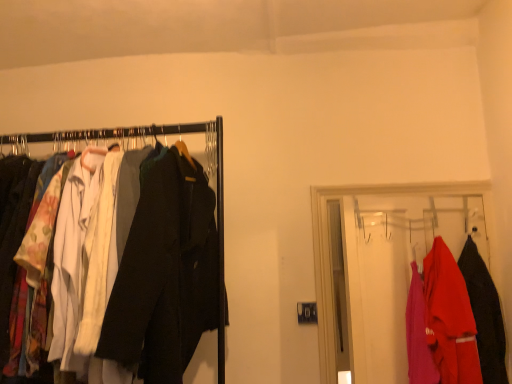
Question: Is matte black coat rack at left, positioned as the 1th closet in left-to-right order, to the left of matte plastic hanger at right, arranged as the second closet when viewed from the left, from the viewer's perspective?

Choices:
 (A) no
 (B) yes

Answer: (B)

Question: Is matte black coat rack at left, positioned as the 1th closet in left-to-right order, outside matte plastic hanger at right, arranged as the second closet when viewed from the left?

Choices:
 (A) yes
 (B) no

Answer: (A)

Question: Considering the relative sizes of matte black coat rack at left, positioned as the 1th closet in left-to-right order, and matte plastic hanger at right, arranged as the second closet when viewed from the left, in the image provided, is matte black coat rack at left, positioned as the 1th closet in left-to-right order, taller than matte plastic hanger at right, arranged as the second closet when viewed from the left,?

Choices:
 (A) no
 (B) yes

Answer: (B)

Question: From a real-world perspective, is matte black coat rack at left, positioned as the 2th closet in right-to-left order, physically above matte plastic hanger at right, arranged as the 1th closet when viewed from the right?

Choices:
 (A) yes
 (B) no

Answer: (A)

Question: Is matte black coat rack at left, positioned as the 1th closet in left-to-right order, further to the viewer compared to matte plastic hanger at right, arranged as the 1th closet when viewed from the right?

Choices:
 (A) yes
 (B) no

Answer: (B)

Question: From the image's perspective, is matte black coat at right, marked as the 2th fancy dress in a left-to-right arrangement, positioned above or below matte red shirt at right, the 1th fancy dress from the left?

Choices:
 (A) below
 (B) above

Answer: (B)

Question: Is matte black coat at right, marked as the 2th fancy dress in a left-to-right arrangement, spatially inside matte red shirt at right, the 1th fancy dress from the left, or outside of it?

Choices:
 (A) inside
 (B) outside

Answer: (B)

Question: In the image, is matte black coat at right, marked as the 2th fancy dress in a left-to-right arrangement, positioned in front of or behind matte red shirt at right, which is the 2th fancy dress in right-to-left order?

Choices:
 (A) front
 (B) behind

Answer: (B)

Question: Does point (481, 344) appear closer or farther from the camera than point (445, 266)?

Choices:
 (A) closer
 (B) farther

Answer: (B)

Question: Based on their positions, is matte black coat rack at left, positioned as the 2th closet in right-to-left order, located to the left or right of matte red shirt at right, which is the 2th fancy dress in right-to-left order?

Choices:
 (A) left
 (B) right

Answer: (A)

Question: From their relative heights in the image, would you say matte black coat rack at left, positioned as the 2th closet in right-to-left order, is taller or shorter than matte red shirt at right, which is the 2th fancy dress in right-to-left order?

Choices:
 (A) short
 (B) tall

Answer: (B)

Question: Based on their sizes in the image, would you say matte black coat rack at left, positioned as the 2th closet in right-to-left order, is bigger or smaller than matte red shirt at right, the 1th fancy dress from the left?

Choices:
 (A) small
 (B) big

Answer: (B)

Question: From the image's perspective, relative to matte red shirt at right, the 1th fancy dress from the left, is matte black coat rack at left, positioned as the 1th closet in left-to-right order, above or below?

Choices:
 (A) below
 (B) above

Answer: (B)

Question: Looking at their shapes, would you say matte black coat at right, marked as the 2th fancy dress in a left-to-right arrangement, is wider or thinner than matte black coat rack at left, positioned as the 2th closet in right-to-left order?

Choices:
 (A) wide
 (B) thin

Answer: (B)

Question: Is matte black coat at right, the 1th fancy dress viewed from the right, bigger or smaller than matte black coat rack at left, positioned as the 1th closet in left-to-right order?

Choices:
 (A) big
 (B) small

Answer: (B)